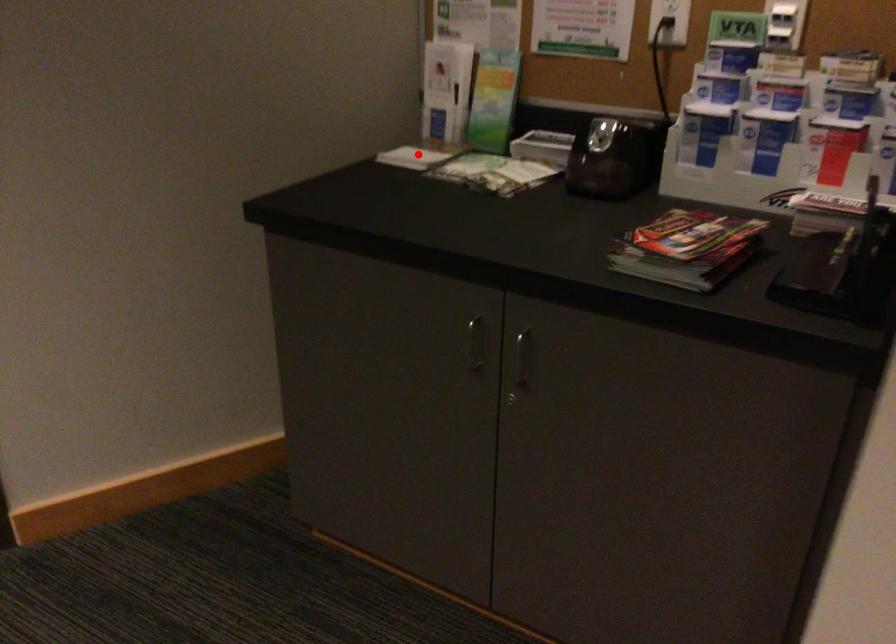
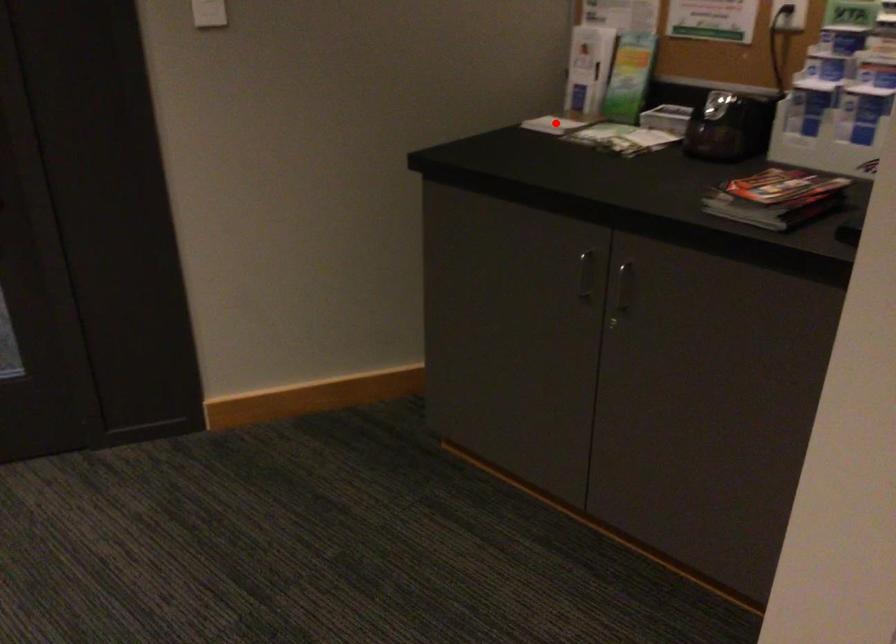
In the scene shown: I am providing you with two images of the same scene from different viewpoints. A red point is marked on the first image and another point is marked on the second image. Are the points marked in image1 and image2 representing the same 3D position?

Answer: Yes